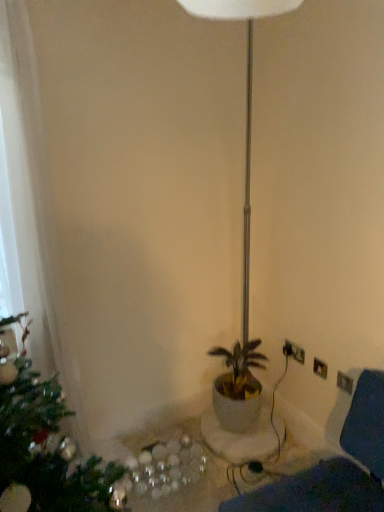
Question: Is white fabric swivel chair at lower right positioned far away from white glossy table at lower center?

Choices:
 (A) no
 (B) yes

Answer: (A)

Question: Can you confirm if white fabric swivel chair at lower right is smaller than white glossy table at lower center?

Choices:
 (A) no
 (B) yes

Answer: (A)

Question: Does white fabric swivel chair at lower right have a greater height compared to white glossy table at lower center?

Choices:
 (A) yes
 (B) no

Answer: (A)

Question: Does white fabric swivel chair at lower right have a lesser height compared to white glossy table at lower center?

Choices:
 (A) no
 (B) yes

Answer: (A)

Question: Is the surface of white fabric swivel chair at lower right in direct contact with white glossy table at lower center?

Choices:
 (A) yes
 (B) no

Answer: (B)

Question: In terms of width, does white glossy table at lower center look wider or thinner when compared to white fabric swivel chair at lower right?

Choices:
 (A) thin
 (B) wide

Answer: (B)

Question: Does point click(x=193, y=415) appear closer or farther from the camera than point click(x=240, y=503)?

Choices:
 (A) closer
 (B) farther

Answer: (B)

Question: In terms of height, does white glossy table at lower center look taller or shorter compared to white fabric swivel chair at lower right?

Choices:
 (A) tall
 (B) short

Answer: (B)

Question: From the image's perspective, is white glossy table at lower center above or below white fabric swivel chair at lower right?

Choices:
 (A) below
 (B) above

Answer: (A)

Question: From the image's perspective, is white fabric swivel chair at lower right above or below white glossy table at lower center?

Choices:
 (A) below
 (B) above

Answer: (B)

Question: Is white fabric swivel chair at lower right spatially inside white glossy table at lower center, or outside of it?

Choices:
 (A) inside
 (B) outside

Answer: (B)

Question: Relative to white glossy table at lower center, is white fabric swivel chair at lower right in front or behind?

Choices:
 (A) front
 (B) behind

Answer: (A)

Question: Considering the positions of white fabric swivel chair at lower right and white glossy table at lower center in the image, is white fabric swivel chair at lower right bigger or smaller than white glossy table at lower center?

Choices:
 (A) big
 (B) small

Answer: (A)

Question: From the image's perspective, relative to white plastic electric outlet at lower right, is white fabric swivel chair at lower right above or below?

Choices:
 (A) above
 (B) below

Answer: (B)

Question: Is white fabric swivel chair at lower right inside the boundaries of white plastic electric outlet at lower right, or outside?

Choices:
 (A) outside
 (B) inside

Answer: (A)